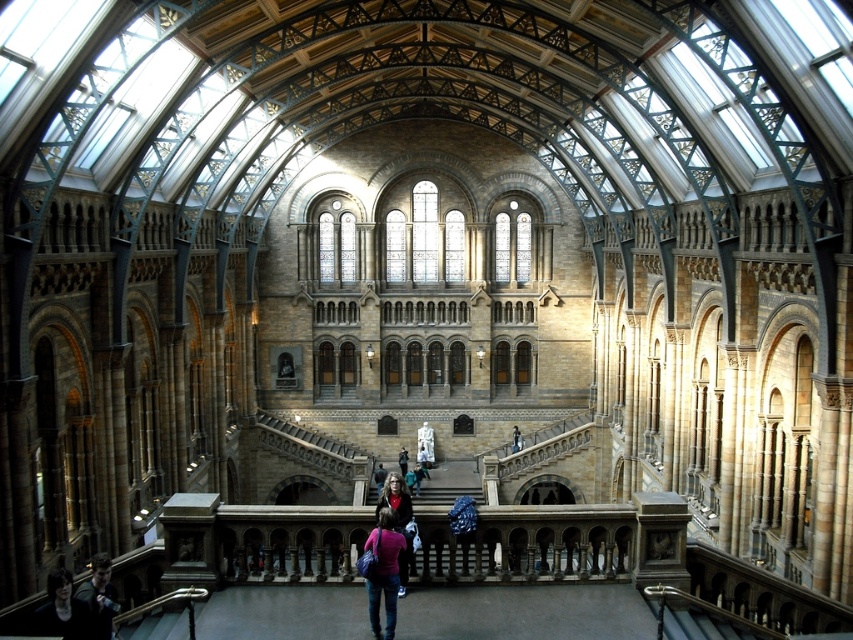
You are an artist standing in the grand historic building and you want to paint both the dark brown hair at center and the matte white statue at center. Since you have limited canvas space, which object should you choose to paint first to ensure it fits on your canvas?

The dark brown hair at center has a smaller size compared to the matte white statue at center, so you should paint the dark brown hair at center first to ensure it fits on the canvas before moving on to the larger statue.

You are a visitor in the museum and you see the dark blue jeans at lower left and the dark brown leather jacket at center. Which one is positioned higher up in the space?

The dark blue jeans at lower left is above the dark brown leather jacket at center, so it is positioned higher up in the space.